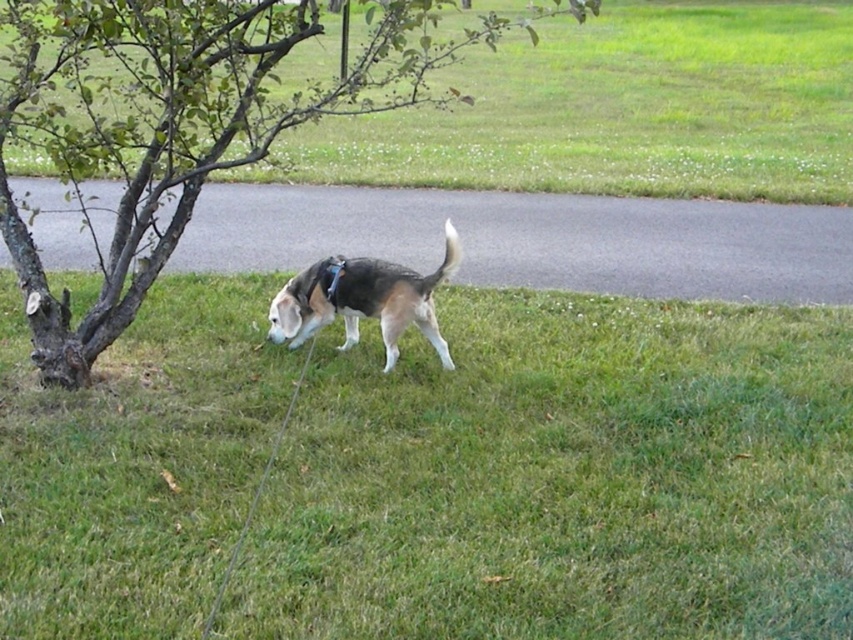
Who is positioned more to the left, brown bark tree at left or brown and white fur dog at center?

brown bark tree at left

Is point (229, 29) in front of point (396, 340)?

Yes, point (229, 29) is closer to viewer.

Does point (112, 112) lie in front of point (450, 250)?

No, (112, 112) is behind (450, 250).

At what (x,y) coordinates should I click in order to perform the action: click on brown bark tree at left. Please return your answer as a coordinate pair (x, y). The image size is (853, 640). Looking at the image, I should click on (173, 122).

Consider the image. Is the position of green grass at center more distant than that of brown bark tree at left?

No, green grass at center is closer to the viewer.

Is point (810, 536) closer to viewer compared to point (212, 49)?

Yes, point (810, 536) is in front of point (212, 49).

Who is more forward, [142,326] or [53,156]?

Point [53,156]

Image resolution: width=853 pixels, height=640 pixels. I want to click on green grass at center, so click(x=563, y=477).

At what (x,y) coordinates should I click in order to perform the action: click on green grass at center. Please return your answer as a coordinate pair (x, y). This screenshot has width=853, height=640. Looking at the image, I should click on (563, 477).

Find the location of a particular element. Image resolution: width=853 pixels, height=640 pixels. green grass at center is located at coordinates (563, 477).